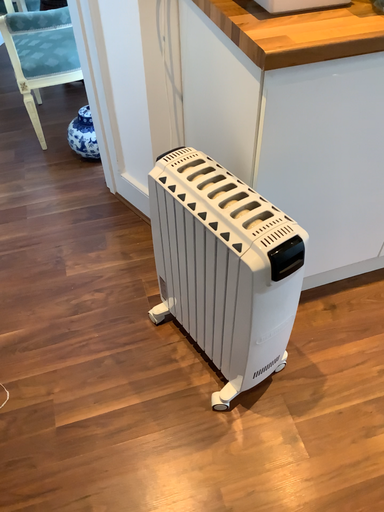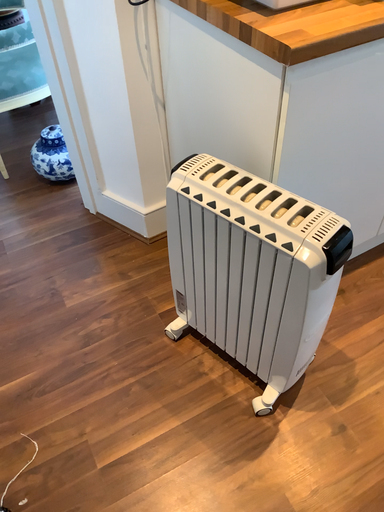
Question: Which way did the camera rotate in the video?

Choices:
 (A) rotated right
 (B) rotated left

Answer: (A)